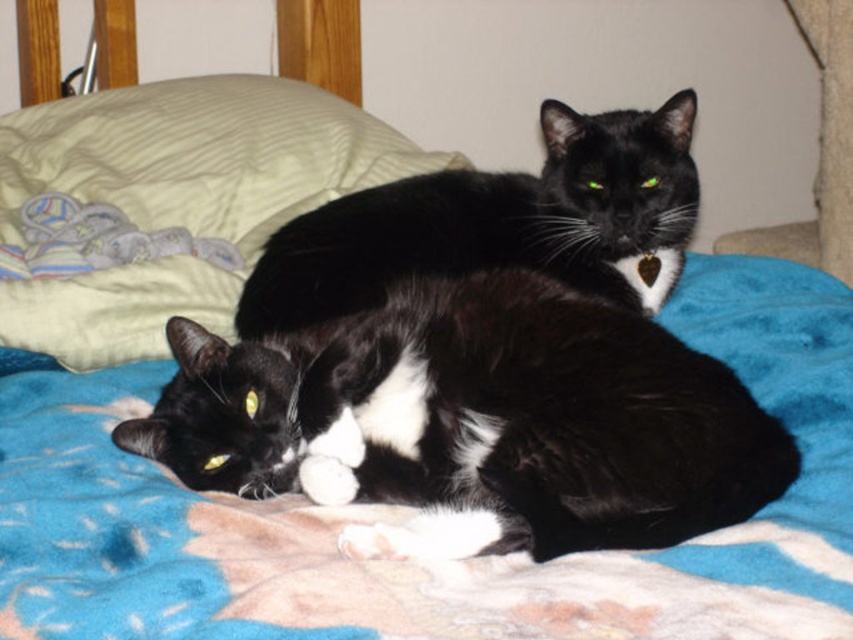
Question: Observing the image, what is the correct spatial positioning of black/white fur cat at lower left in reference to black glossy cat at upper center?

Choices:
 (A) above
 (B) below

Answer: (B)

Question: Based on their relative distances, which object is farther from the light green quilted pillow at upper left?

Choices:
 (A) black glossy cat at upper center
 (B) black/white fur cat at lower left

Answer: (B)

Question: Among these objects, which one is farthest from the camera?

Choices:
 (A) black/white fur cat at lower left
 (B) light green quilted pillow at upper left

Answer: (B)

Question: Which point is closer to the camera?

Choices:
 (A) black glossy cat at upper center
 (B) light green quilted pillow at upper left

Answer: (B)

Question: Does light green quilted pillow at upper left have a smaller size compared to black glossy cat at upper center?

Choices:
 (A) yes
 (B) no

Answer: (B)

Question: Is black/white fur cat at lower left smaller than light green quilted pillow at upper left?

Choices:
 (A) no
 (B) yes

Answer: (B)